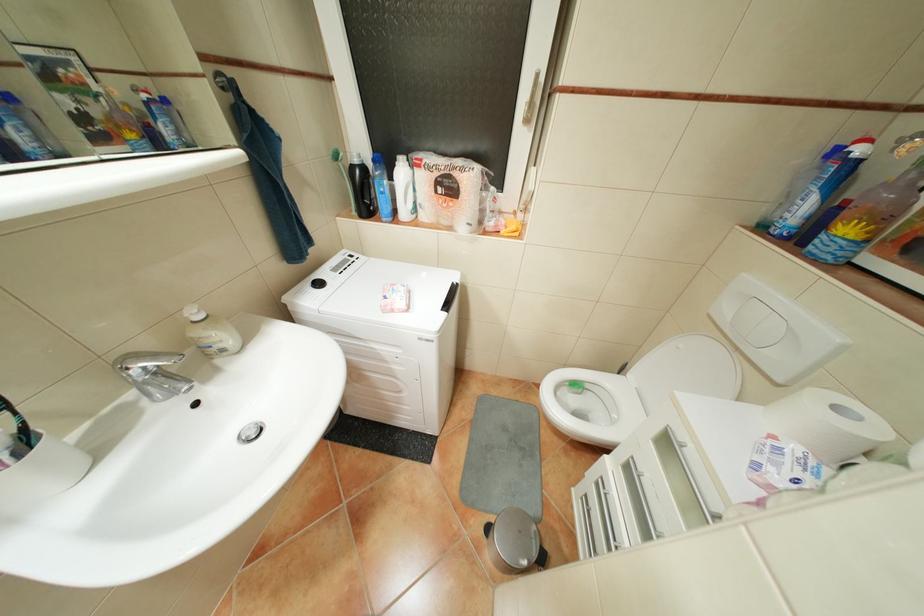
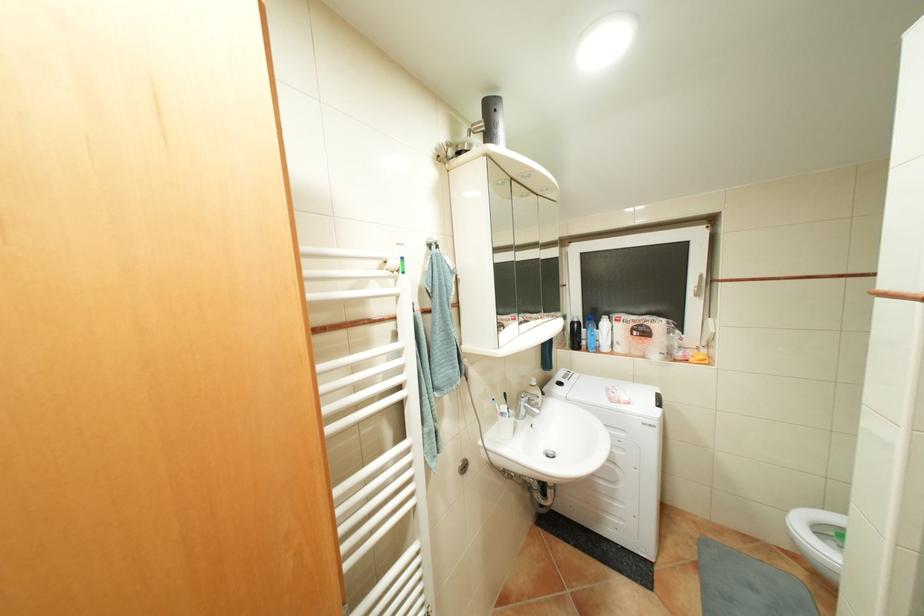
The point at [480,176] is marked in the first image. Where is the corresponding point in the second image?

(667, 323)